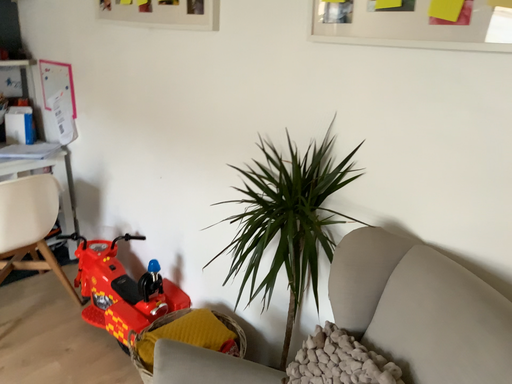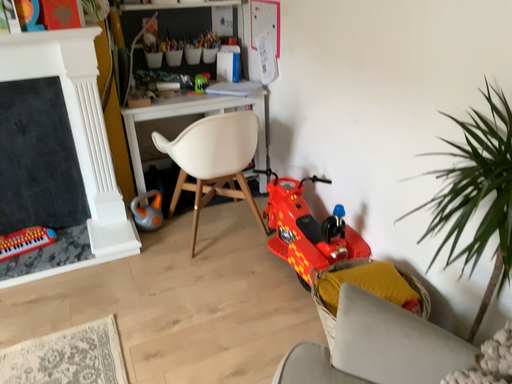
Question: How did the camera likely rotate when shooting the video?

Choices:
 (A) rotated right
 (B) rotated left

Answer: (B)